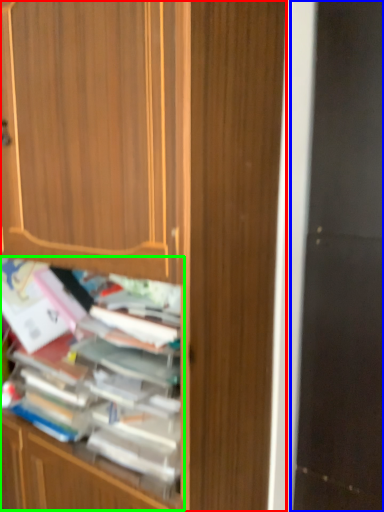
Question: Which is nearer to the cabinetry (highlighted by a red box)? screen door (highlighted by a blue box) or shelf (highlighted by a green box).

Choices:
 (A) screen door
 (B) shelf

Answer: (B)